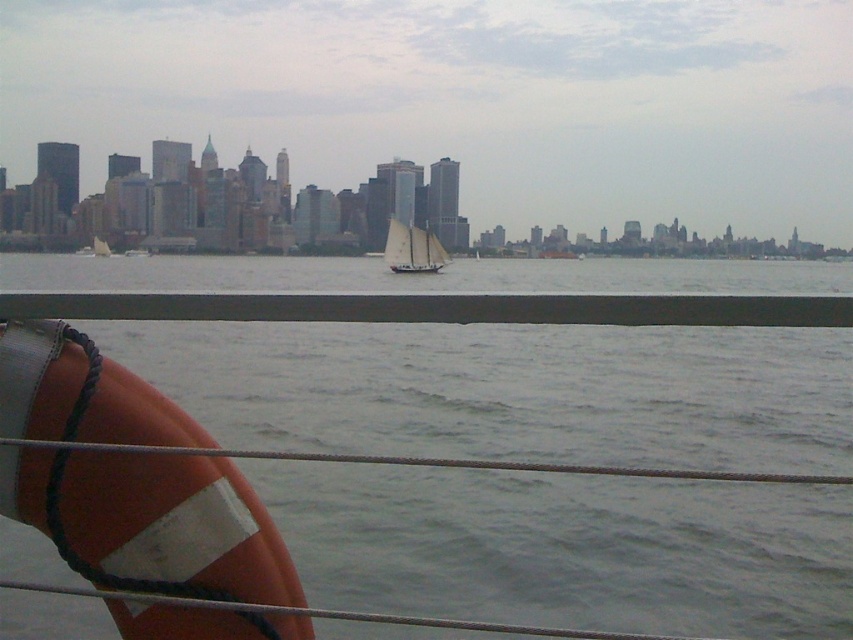
Between gray water at center and white matte sailboat at center, which one appears on the right side from the viewer's perspective?

Positioned to the right is white matte sailboat at center.

Does gray water at center appear on the right side of white matte sailboat at center?

Incorrect, gray water at center is not on the right side of white matte sailboat at center.

Which is in front, point (724, 326) or point (387, 262)?

Positioned in front is point (724, 326).

Image resolution: width=853 pixels, height=640 pixels. In order to click on gray water at center in this screenshot , I will do `click(509, 390)`.

Locate an element on the screen. This screenshot has width=853, height=640. gray water at center is located at coordinates (509, 390).

Can you confirm if gray water at center is positioned below orange rubber life jacket at lower left?

No.

This screenshot has width=853, height=640. I want to click on gray water at center, so click(509, 390).

Where is `gray water at center`? gray water at center is located at coordinates (509, 390).

Is orange rubber life jacket at lower left further to the viewer compared to white matte sailboat at center?

No, it is in front of white matte sailboat at center.

Is orange rubber life jacket at lower left positioned before white matte sailboat at center?

Yes, it is.

Where is `orange rubber life jacket at lower left`? orange rubber life jacket at lower left is located at coordinates (151, 522).